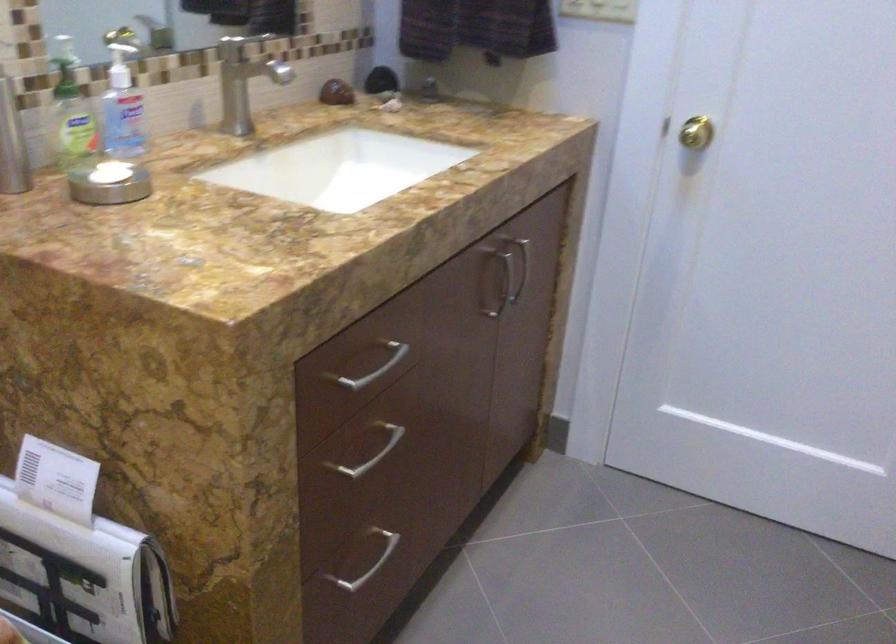
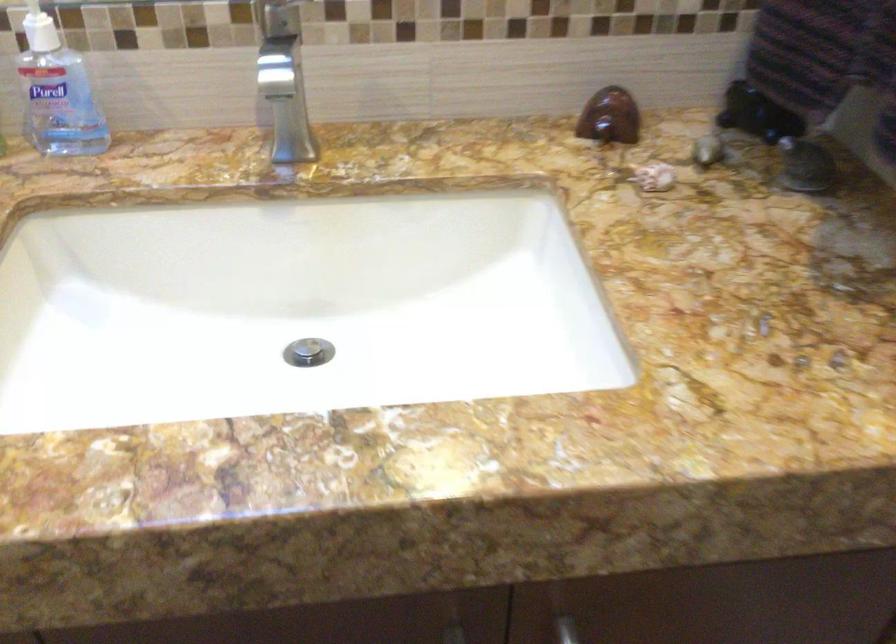
Where in the second image is the point corresponding to point 418,116 from the first image?

(708, 149)